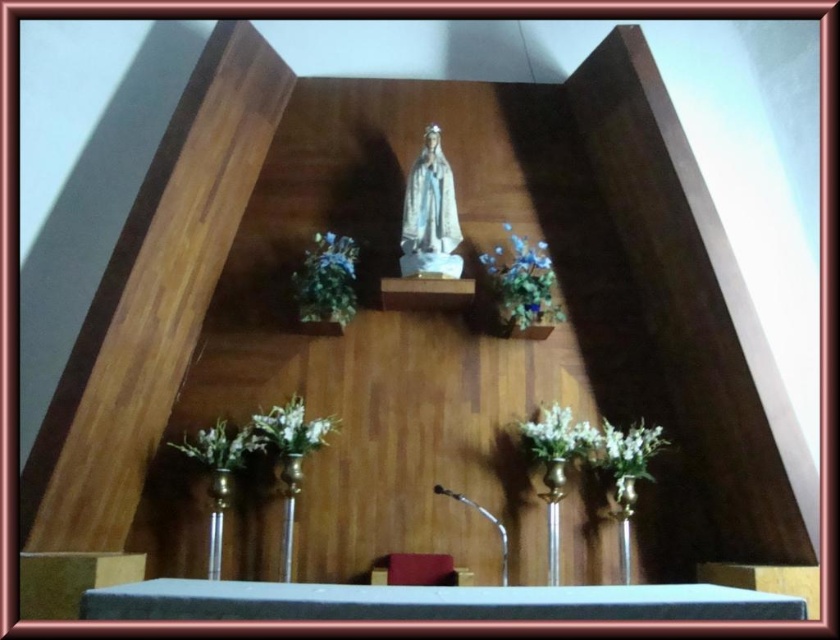
Which is behind, point (520, 332) or point (303, 292)?

The point (520, 332) is more distant.

Which is above, silky blue flowers at upper right or green leafy plant at upper center?

silky blue flowers at upper right is higher up.

Between point (550, 330) and point (306, 262), which one is positioned behind?

The point (306, 262) is more distant.

You are a GUI agent. You are given a task and a screenshot of the screen. Output one action in this format:
    pyautogui.click(x=<x>, y=<y>)
    Task: Click on the silky blue flowers at upper right
    
    Given the screenshot: What is the action you would take?
    pyautogui.click(x=523, y=285)

Can you confirm if silky blue flowers at upper right is wider than white floral arrangement at lower right?

Yes.

Does silky blue flowers at upper right have a larger size compared to white floral arrangement at lower right?

Correct, silky blue flowers at upper right is larger in size than white floral arrangement at lower right.

Describe the element at coordinates (523, 285) in the screenshot. I see `silky blue flowers at upper right` at that location.

Locate an element on the screen. This screenshot has width=840, height=640. silky blue flowers at upper right is located at coordinates (523, 285).

Can you confirm if white floral arrangement at lower right is shorter than white matte flowers at center?

Yes, white floral arrangement at lower right is shorter than white matte flowers at center.

Between white floral arrangement at lower right and white matte flowers at center, which one has less height?

Standing shorter between the two is white floral arrangement at lower right.

I want to click on white floral arrangement at lower right, so click(557, 435).